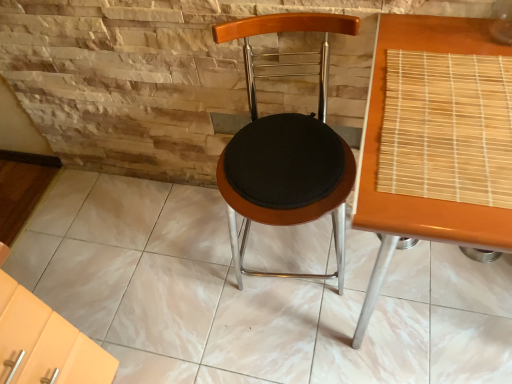
Question: Is wooden bamboo mat at right positioned far away from woodenseat cushion at center?

Choices:
 (A) no
 (B) yes

Answer: (A)

Question: Is wooden bamboo mat at right oriented away from woodenseat cushion at center?

Choices:
 (A) no
 (B) yes

Answer: (A)

Question: Are wooden bamboo mat at right and woodenseat cushion at center beside each other?

Choices:
 (A) no
 (B) yes

Answer: (A)

Question: Is wooden bamboo mat at right to the left of woodenseat cushion at center from the viewer's perspective?

Choices:
 (A) yes
 (B) no

Answer: (B)

Question: Is wooden bamboo mat at right to the right of woodenseat cushion at center from the viewer's perspective?

Choices:
 (A) yes
 (B) no

Answer: (A)

Question: Would you say woodenseat cushion at center is part of wooden bamboo mat at right's contents?

Choices:
 (A) yes
 (B) no

Answer: (B)

Question: Does bamboo mat at right have a greater height compared to woodenseat cushion at center?

Choices:
 (A) yes
 (B) no

Answer: (B)

Question: Is bamboo mat at right behind woodenseat cushion at center?

Choices:
 (A) yes
 (B) no

Answer: (B)

Question: From a real-world perspective, does bamboo mat at right stand above woodenseat cushion at center?

Choices:
 (A) no
 (B) yes

Answer: (B)

Question: Is bamboo mat at right to the left of woodenseat cushion at center from the viewer's perspective?

Choices:
 (A) no
 (B) yes

Answer: (A)

Question: From a real-world perspective, does bamboo mat at right sit lower than woodenseat cushion at center?

Choices:
 (A) yes
 (B) no

Answer: (B)

Question: Is bamboo mat at right bigger than woodenseat cushion at center?

Choices:
 (A) no
 (B) yes

Answer: (A)

Question: From a real-world perspective, is bamboo mat at right positioned over wooden bamboo mat at right based on gravity?

Choices:
 (A) yes
 (B) no

Answer: (A)